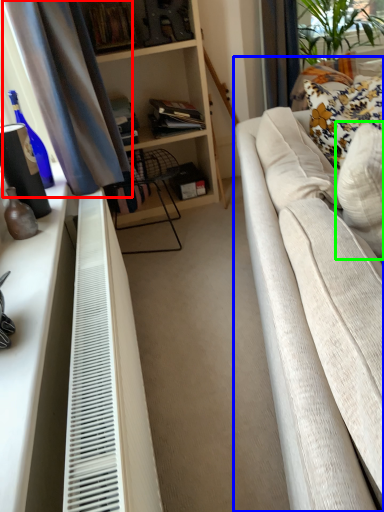
Question: Based on their relative distances, which object is farther from curtain (highlighted by a red box)? Choose from studio couch (highlighted by a blue box) and pillow (highlighted by a green box).

Choices:
 (A) studio couch
 (B) pillow

Answer: (B)